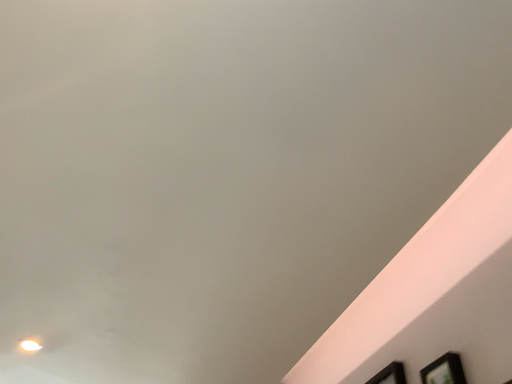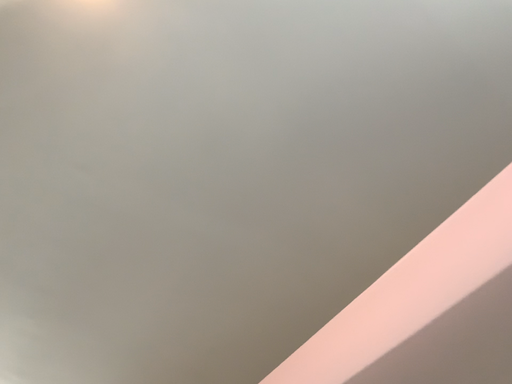
Question: How did the camera likely rotate when shooting the video?

Choices:
 (A) rotated right
 (B) rotated left

Answer: (A)